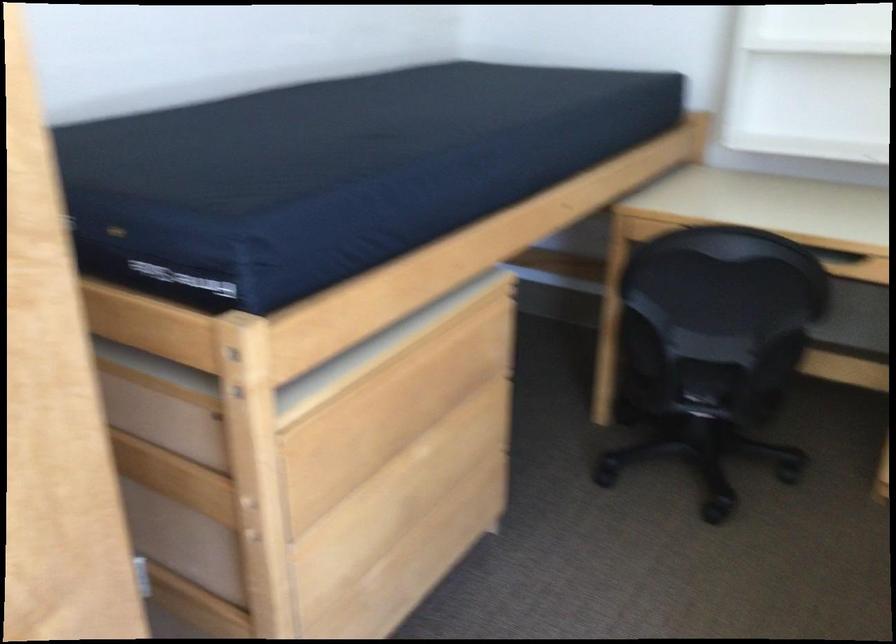
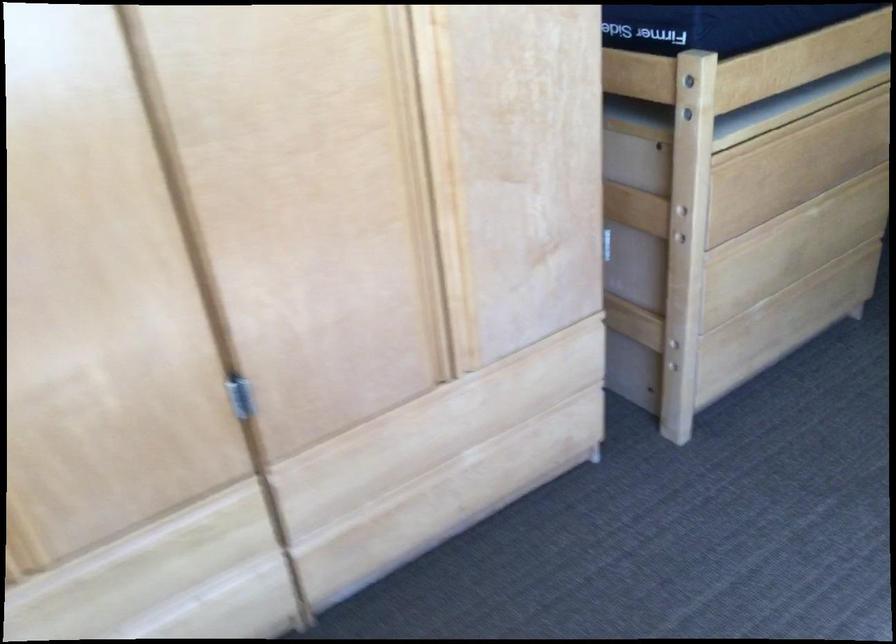
Where in the second image is the point corresponding to point (368, 448) from the first image?

(767, 185)